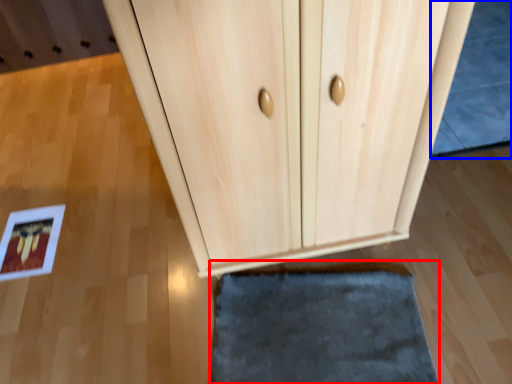
Question: Which point is closer to the camera, door (highlighted by a red box) or bath mat (highlighted by a blue box)?

Choices:
 (A) door
 (B) bath mat

Answer: (A)